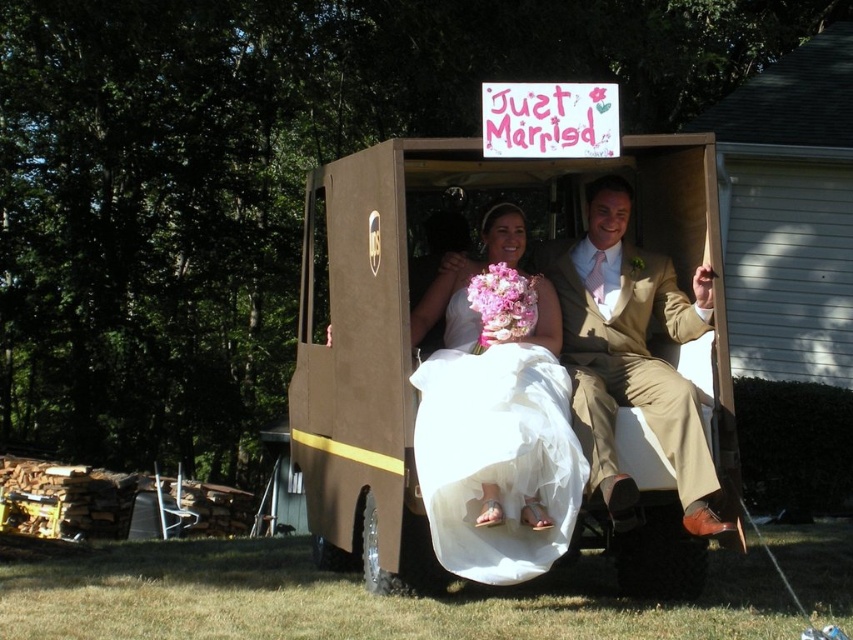
Does point (560, 232) come in front of point (612, 397)?

No, (560, 232) is further to viewer.

Is point (372, 588) positioned behind point (686, 340)?

Yes, it is behind point (686, 340).

Locate an element on the screen. This screenshot has height=640, width=853. brown cardboard golf cart at center is located at coordinates (450, 324).

What do you see at coordinates (450, 324) in the screenshot? The width and height of the screenshot is (853, 640). I see `brown cardboard golf cart at center` at bounding box center [450, 324].

Does brown cardboard golf cart at center appear under pink silk bouquet at center?

Correct, brown cardboard golf cart at center is located below pink silk bouquet at center.

This screenshot has width=853, height=640. Describe the element at coordinates (450, 324) in the screenshot. I see `brown cardboard golf cart at center` at that location.

Identify the location of brown cardboard golf cart at center. The height and width of the screenshot is (640, 853). (450, 324).

The image size is (853, 640). Identify the location of white satin dress at center. (494, 426).

Who is higher up, white satin dress at center or tan fabric suit at center?

tan fabric suit at center

What do you see at coordinates (494, 426) in the screenshot? The image size is (853, 640). I see `white satin dress at center` at bounding box center [494, 426].

This screenshot has width=853, height=640. I want to click on white satin dress at center, so click(x=494, y=426).